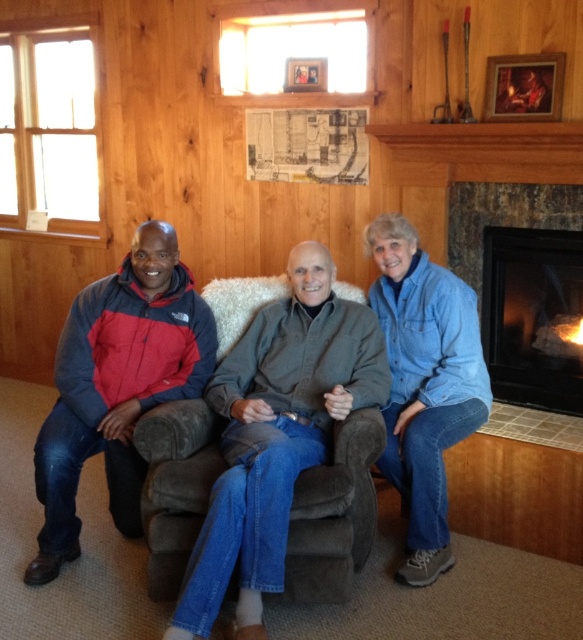
You are a photographer trying to capture a closeup of the black stone fireplace at right without including the denim jeans at center in the frame. Given their sizes, is this possible?

The denim jeans at center is bigger than the black stone fireplace at right, so it might be challenging to exclude the denim jeans at center from the frame due to its larger size.

Please provide the exact coordinates of the denim jeans at center in the image.

The denim jeans at center are located at coordinates point (276, 435).